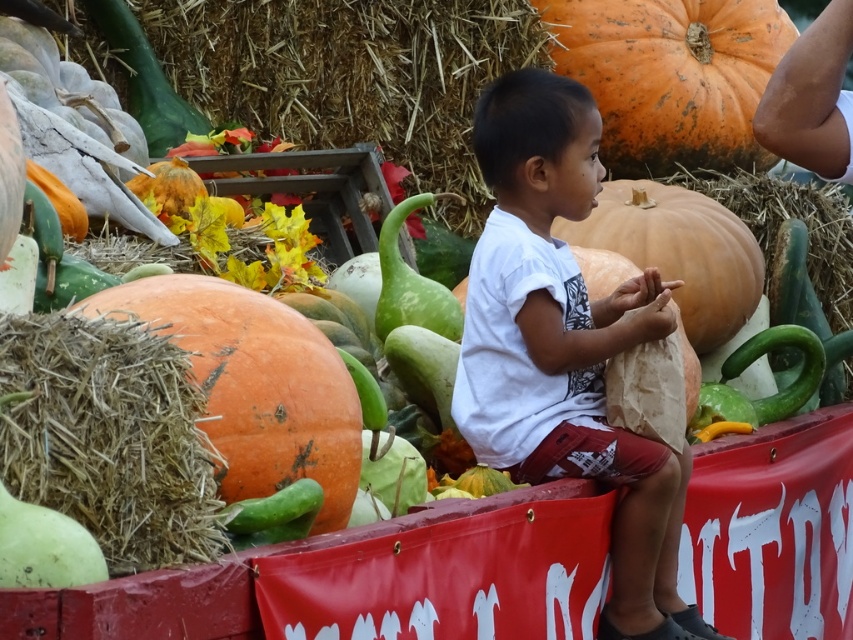
Question: Is white cotton shirt at center positioned in front of orange matte pumpkin at left?

Choices:
 (A) yes
 (B) no

Answer: (B)

Question: Can you confirm if brown straw at lower left is positioned to the right of orange matte pumpkin at center?

Choices:
 (A) no
 (B) yes

Answer: (A)

Question: Which of these objects is positioned closest to the white cotton shirt at center?

Choices:
 (A) brown straw at lower left
 (B) orange matte pumpkin at center
 (C) orange matte pumpkin at upper right

Answer: (B)

Question: Can you confirm if orange matte pumpkin at left is wider than orange matte pumpkin at center?

Choices:
 (A) yes
 (B) no

Answer: (B)

Question: Among these points, which one is nearest to the camera?

Choices:
 (A) (608, 193)
 (B) (239, 353)
 (C) (151, 525)
 (D) (720, 134)

Answer: (C)

Question: Estimate the real-world distances between objects in this image. Which object is farther from the orange matte pumpkin at center?

Choices:
 (A) brown straw at lower left
 (B) orange matte pumpkin at left
 (C) white cotton shirt at center

Answer: (A)